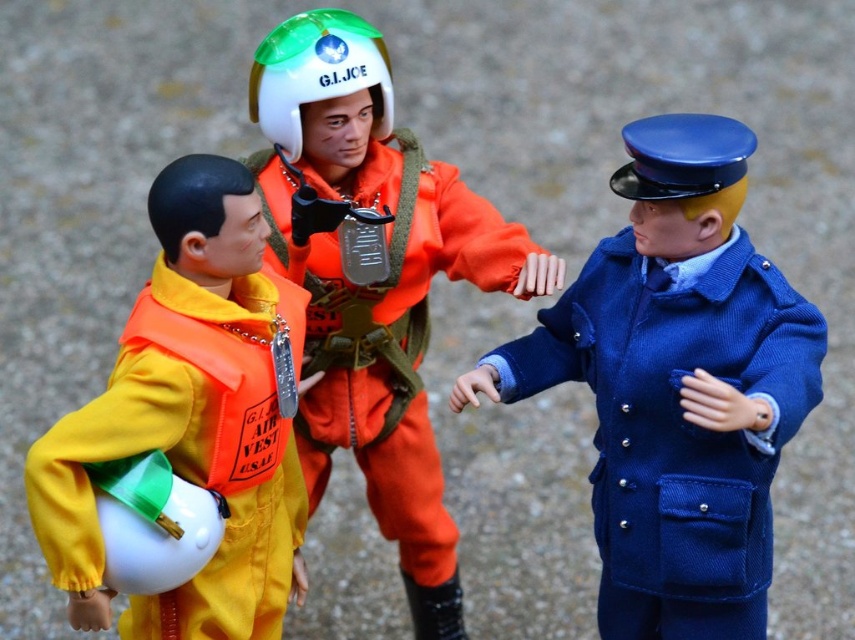
Question: Can you confirm if blue woolen coat at center is thinner than orange matte jumpsuit at center?

Choices:
 (A) yes
 (B) no

Answer: (A)

Question: Estimate the real-world distances between objects in this image. Which object is closer to the white matte helmet at center?

Choices:
 (A) orange fabric life vest at left
 (B) blue matte helmet at upper right
 (C) orange matte jumpsuit at center

Answer: (C)

Question: Which object is farther from the camera taking this photo?

Choices:
 (A) blue matte helmet at upper right
 (B) blue woolen coat at center
 (C) orange fabric life vest at left

Answer: (A)

Question: Does orange fabric life vest at left come in front of blue matte helmet at upper right?

Choices:
 (A) no
 (B) yes

Answer: (B)

Question: Observing the image, what is the correct spatial positioning of blue woolen coat at center in reference to blue matte helmet at upper right?

Choices:
 (A) below
 (B) above

Answer: (A)

Question: Which object is positioned farthest from the orange matte jumpsuit at center?

Choices:
 (A) blue woolen coat at center
 (B) white matte helmet at center
 (C) blue matte helmet at upper right
 (D) orange fabric life vest at left

Answer: (C)